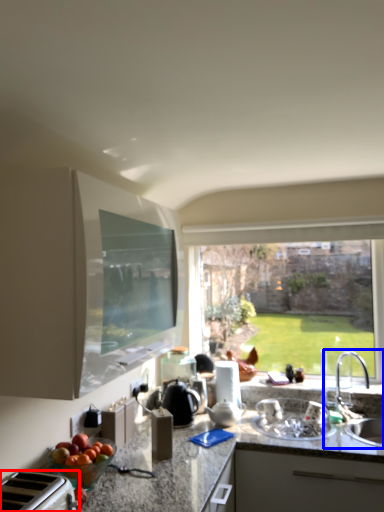
Question: Which point is further to the camera, appliance (highlighted by a red box) or sink (highlighted by a blue box)?

Choices:
 (A) appliance
 (B) sink

Answer: (B)